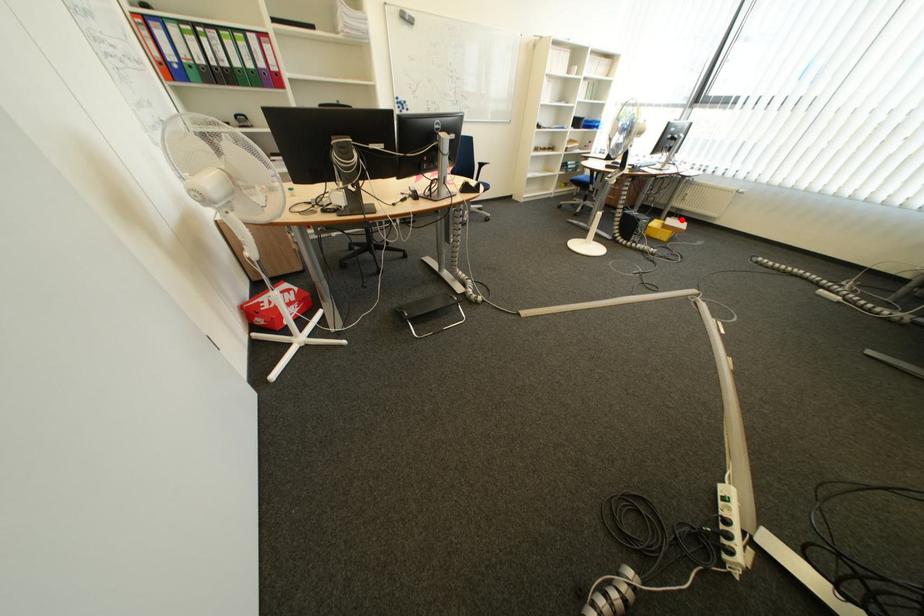
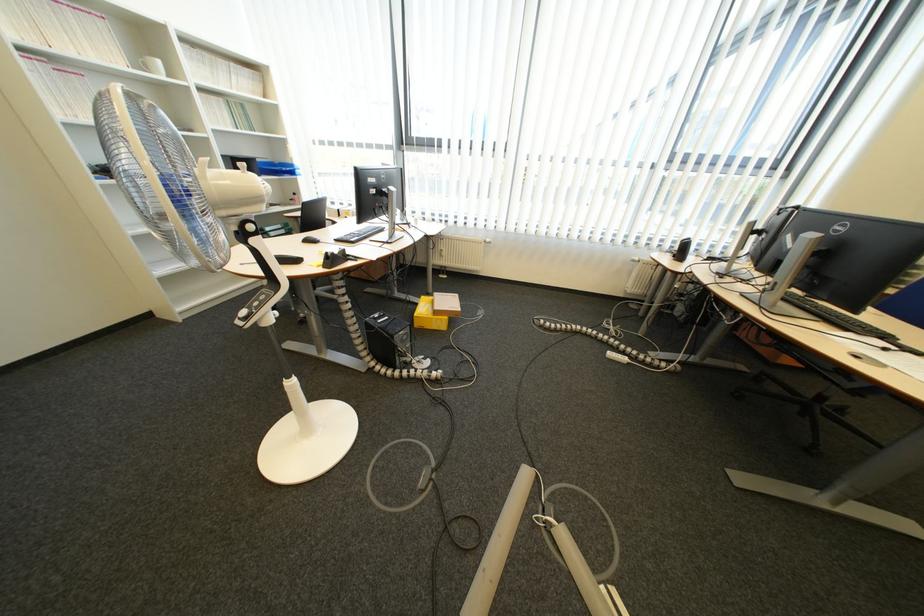
Find the pixel in the second image that matches the highlighted location in the first image.

(448, 294)